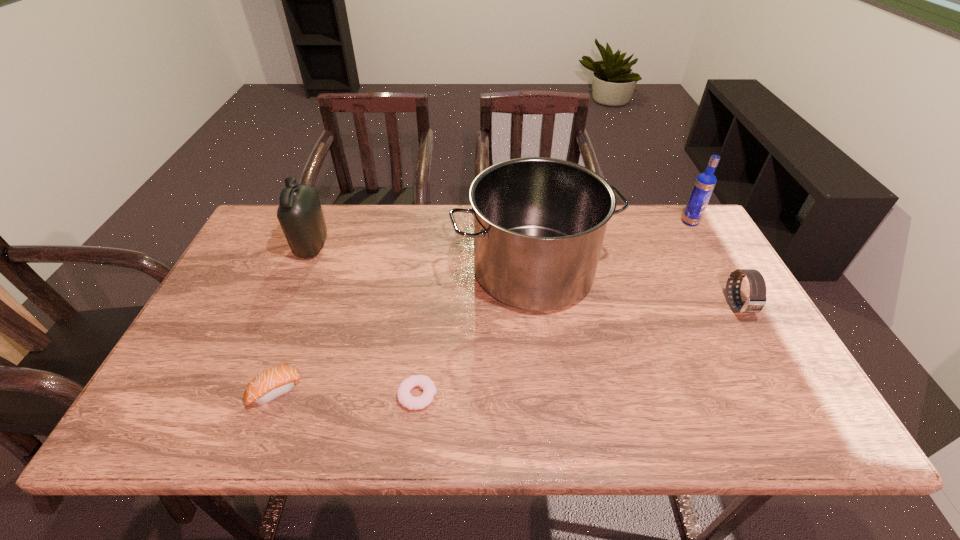
I want to click on vacant region that satisfies the following two spatial constraints: 1. on the back side of the doughnut; 2. on the left side of the third object from right to left, so click(x=432, y=271).

The width and height of the screenshot is (960, 540). What are the coordinates of `free space that satisfies the following two spatial constraints: 1. on the back side of the third object from right to left; 2. on the left side of the vodka` in the screenshot? It's located at (527, 222).

This screenshot has width=960, height=540. I want to click on free space that satisfies the following two spatial constraints: 1. on the back side of the farthest object; 2. on the left side of the bottle, so click(323, 222).